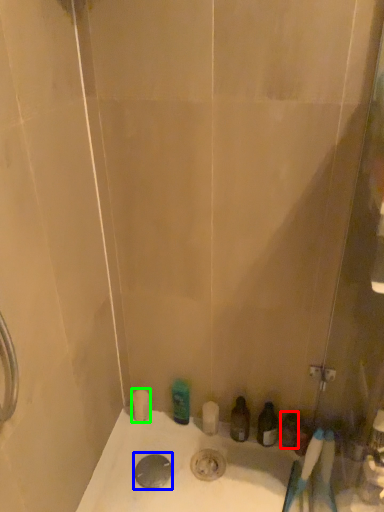
Question: Based on their relative distances, which object is nearer to toiletry (highlighted by a red box)? Choose from drain (highlighted by a blue box) and toilet paper (highlighted by a green box).

Choices:
 (A) drain
 (B) toilet paper

Answer: (A)